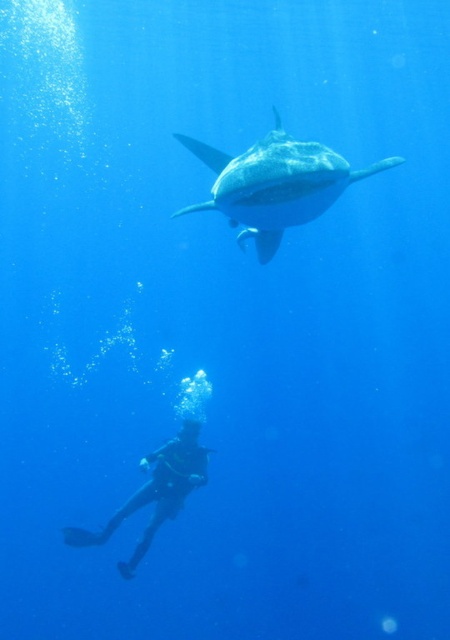
Question: Does smooth gray shark at upper center have a lesser width compared to black rubber wetsuit at lower left?

Choices:
 (A) yes
 (B) no

Answer: (A)

Question: Which point is closer to the camera?

Choices:
 (A) coord(287,198)
 (B) coord(130,500)

Answer: (A)

Question: Which object is closer to the camera taking this photo?

Choices:
 (A) black rubber wetsuit at lower left
 (B) smooth gray shark at upper center

Answer: (B)

Question: Can you confirm if smooth gray shark at upper center is smaller than black rubber wetsuit at lower left?

Choices:
 (A) no
 (B) yes

Answer: (A)

Question: Does smooth gray shark at upper center have a larger size compared to black rubber wetsuit at lower left?

Choices:
 (A) no
 (B) yes

Answer: (B)